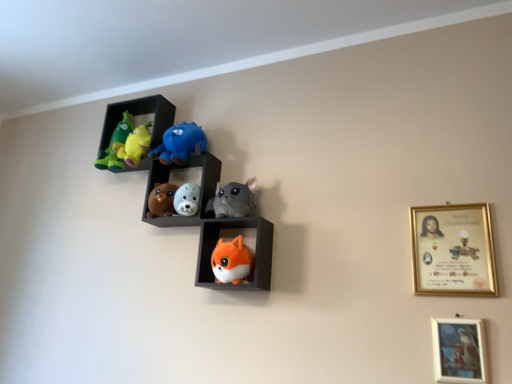
Question: Does matte blue plush at upper center, arranged as the 1th toy when viewed from the top, have a lesser width compared to gold-framed painting at lower right, which ranks as the 1th picture frame in bottom-to-top order?

Choices:
 (A) yes
 (B) no

Answer: (B)

Question: Can you confirm if matte blue plush at upper center, arranged as the 1th toy when viewed from the top, is smaller than gold-framed painting at lower right, which ranks as the 1th picture frame in bottom-to-top order?

Choices:
 (A) no
 (B) yes

Answer: (A)

Question: Can you confirm if matte blue plush at upper center, the 5th toy from the bottom, is bigger than gold-framed painting at lower right, which ranks as the 2th picture frame in top-to-bottom order?

Choices:
 (A) no
 (B) yes

Answer: (B)

Question: Are matte blue plush at upper center, the 5th toy from the bottom, and gold-framed painting at lower right, which ranks as the 2th picture frame in top-to-bottom order, beside each other?

Choices:
 (A) yes
 (B) no

Answer: (B)

Question: Is matte blue plush at upper center, the 5th toy from the bottom, taller than gold-framed painting at lower right, which ranks as the 2th picture frame in top-to-bottom order?

Choices:
 (A) no
 (B) yes

Answer: (B)

Question: Is matte blue plush at upper center, the 5th toy from the bottom, facing away from gold-framed painting at lower right, which ranks as the 2th picture frame in top-to-bottom order?

Choices:
 (A) no
 (B) yes

Answer: (A)

Question: Is soft plush toys at center, the third toy in the bottom-to-top sequence, positioned beyond the bounds of fluffy white plush seal at center, positioned as the fourth toy in top-to-bottom order?

Choices:
 (A) yes
 (B) no

Answer: (A)

Question: Considering the relative positions of soft plush toys at center, which is the 3th toy in top-to-bottom order, and fluffy white plush seal at center, positioned as the fourth toy in top-to-bottom order, in the image provided, is soft plush toys at center, which is the 3th toy in top-to-bottom order, to the left of fluffy white plush seal at center, positioned as the fourth toy in top-to-bottom order, from the viewer's perspective?

Choices:
 (A) yes
 (B) no

Answer: (A)

Question: Considering the relative sizes of soft plush toys at center, which is the 3th toy in top-to-bottom order, and fluffy white plush seal at center, which is counted as the second toy, starting from the bottom, in the image provided, is soft plush toys at center, which is the 3th toy in top-to-bottom order, shorter than fluffy white plush seal at center, which is counted as the second toy, starting from the bottom,?

Choices:
 (A) no
 (B) yes

Answer: (A)

Question: Is soft plush toys at center, which is the 3th toy in top-to-bottom order, surrounding fluffy white plush seal at center, positioned as the fourth toy in top-to-bottom order?

Choices:
 (A) no
 (B) yes

Answer: (A)

Question: Considering the relative sizes of soft plush toys at center, which is the 3th toy in top-to-bottom order, and fluffy white plush seal at center, positioned as the fourth toy in top-to-bottom order, in the image provided, is soft plush toys at center, which is the 3th toy in top-to-bottom order, smaller than fluffy white plush seal at center, positioned as the fourth toy in top-to-bottom order,?

Choices:
 (A) no
 (B) yes

Answer: (A)

Question: Is soft plush toys at center, the third toy in the bottom-to-top sequence, thinner than fluffy white plush seal at center, positioned as the fourth toy in top-to-bottom order?

Choices:
 (A) yes
 (B) no

Answer: (B)

Question: Can you confirm if gray plush cat at center, which appears as the 2th toy when viewed from the top, is bigger than fluffy plush toys at center, arranged as the second shelf when viewed from the top?

Choices:
 (A) yes
 (B) no

Answer: (B)